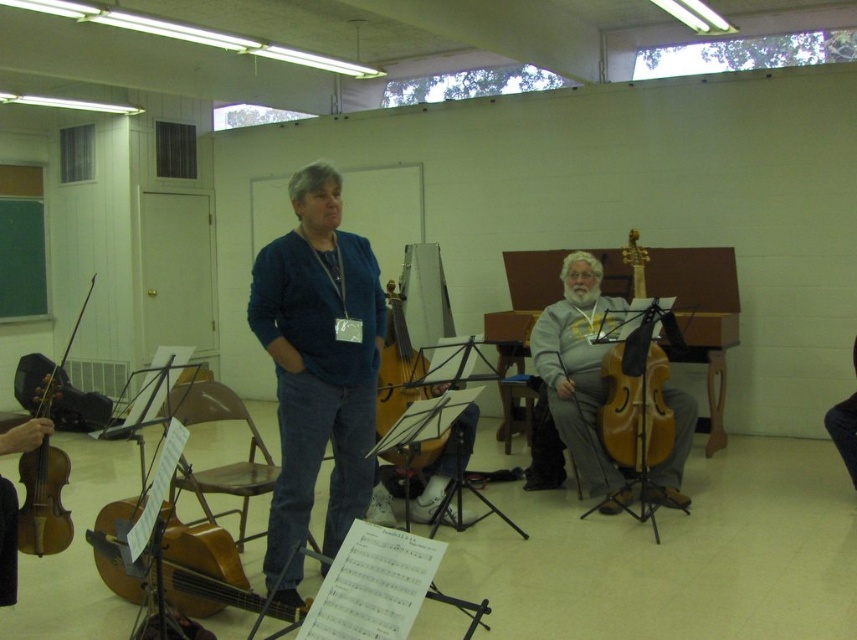
Is point (256, 492) farther from camera compared to point (393, 381)?

No.

Is metallic brown chair at center bigger than wooden violin at center?

Correct, metallic brown chair at center is larger in size than wooden violin at center.

What do you see at coordinates (223, 465) in the screenshot? This screenshot has height=640, width=857. I see `metallic brown chair at center` at bounding box center [223, 465].

You are a GUI agent. You are given a task and a screenshot of the screen. Output one action in this format:
    pyautogui.click(x=<x>, y=<y>)
    Task: Click on the metallic brown chair at center
    The width and height of the screenshot is (857, 640).
    Given the screenshot: What is the action you would take?
    pyautogui.click(x=223, y=465)

Does golden wood cello at center lie in front of metallic brown chair at center?

No, it is not.

Does point (644, 308) come closer to viewer compared to point (202, 390)?

No, (644, 308) is further to viewer.

Find the location of a particular element. The height and width of the screenshot is (640, 857). golden wood cello at center is located at coordinates (634, 406).

Which is above, metallic brown chair at center or wooden violin at left?

metallic brown chair at center

Is metallic brown chair at center shorter than wooden violin at left?

Incorrect, metallic brown chair at center's height does not fall short of wooden violin at left's.

Which is behind, point (222, 477) or point (45, 467)?

The point (222, 477) is behind.

I want to click on metallic brown chair at center, so click(x=223, y=465).